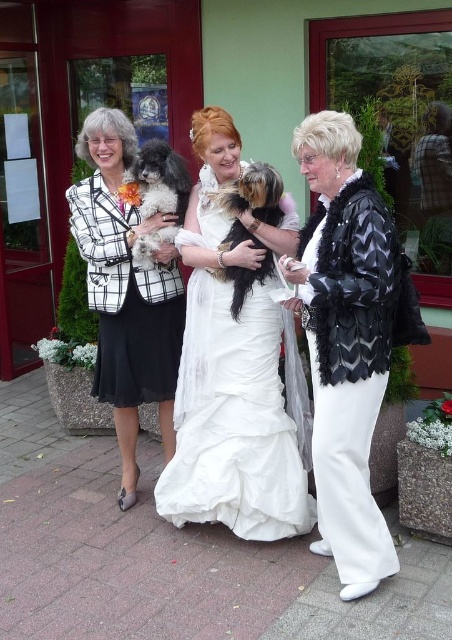
Does point (132, 333) come farther from viewer compared to point (174, 161)?

Yes, point (132, 333) is farther from viewer.

Find the location of a particular element. This screenshot has height=640, width=452. matte black blazer at left is located at coordinates (127, 291).

Is matte black blazer at left positioned in front of fuzzy brown dog at center?

That is False.

Measure the distance from matte black blazer at left to fuzzy brown dog at center.

The distance of matte black blazer at left from fuzzy brown dog at center is 19.52 inches.

Which is in front, point (135, 440) or point (255, 198)?

Point (255, 198) is in front.

Locate an element on the screen. matte black blazer at left is located at coordinates (127, 291).

This screenshot has height=640, width=452. What do you see at coordinates (239, 417) in the screenshot? I see `white satin dress at center` at bounding box center [239, 417].

Does white satin dress at center appear under black and white fur at center?

Correct, white satin dress at center is located below black and white fur at center.

Who is more distant from viewer, (269,472) or (141,252)?

The point (141,252) is more distant.

Where is `white satin dress at center`? The width and height of the screenshot is (452, 640). white satin dress at center is located at coordinates click(x=239, y=417).